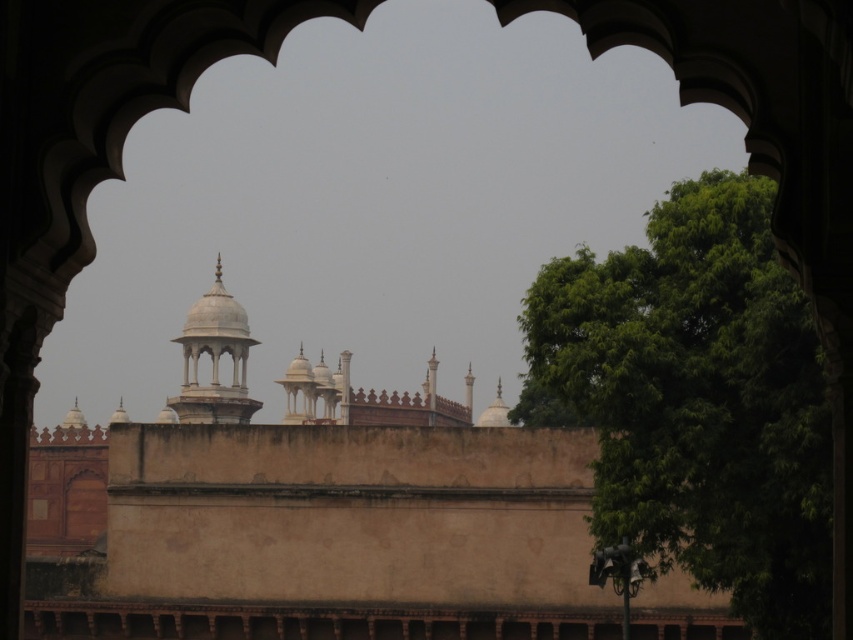
Is the position of green leafy tree at right less distant than that of white marble tower at center?

Yes, it is in front of white marble tower at center.

Describe the element at coordinates (695, 401) in the screenshot. This screenshot has width=853, height=640. I see `green leafy tree at right` at that location.

Image resolution: width=853 pixels, height=640 pixels. Identify the location of green leafy tree at right. (695, 401).